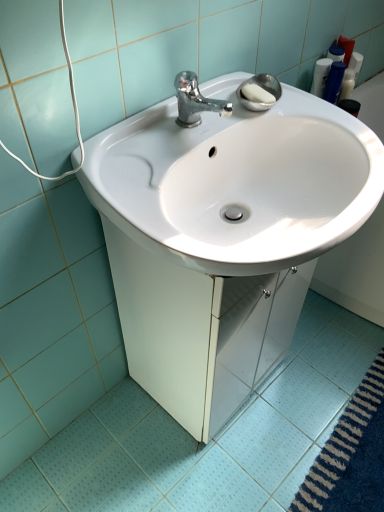
What do you see at coordinates (223, 239) in the screenshot? Image resolution: width=384 pixels, height=512 pixels. I see `white glossy sink at center` at bounding box center [223, 239].

What do you see at coordinates (210, 442) in the screenshot?
I see `white glossy ceramic tile at lower center` at bounding box center [210, 442].

In order to face white glossy sink at center, should I rotate leftwards or rightwards?

Rotate right and turn 26.380 degrees.

At what (x,y) coordinates should I click in order to perform the action: click on white glossy sink at center. Please return your answer as a coordinate pair (x, y). This screenshot has width=384, height=512. Looking at the image, I should click on (223, 239).

Which is more to the left, white glossy sink at center or white glossy ceramic tile at lower center?

white glossy sink at center.

Is the surface of white glossy sink at center in direct contact with white glossy ceramic tile at lower center?

white glossy sink at center is not next to white glossy ceramic tile at lower center, and they're not touching.

Is white glossy sink at center closer to the viewer compared to white glossy ceramic tile at lower center?

Yes.

Can you confirm if white glossy sink at center is shorter than white glossy ceramic tile at lower center?

No, white glossy sink at center is not shorter than white glossy ceramic tile at lower center.

Does point (293, 352) appear closer or farther from the camera than point (198, 94)?

Point (293, 352) is farther from the camera than point (198, 94).

From a real-world perspective, is white glossy ceramic tile at lower center physically located above or below chrome metallic faucet at upper center?

white glossy ceramic tile at lower center is below chrome metallic faucet at upper center.

Between white glossy ceramic tile at lower center and chrome metallic faucet at upper center, which one has larger size?

white glossy ceramic tile at lower center is bigger.

Where is `ceramic tile lying in front of the white glossy sink at center`? Image resolution: width=384 pixels, height=512 pixels. ceramic tile lying in front of the white glossy sink at center is located at coordinates (210, 442).

From a real-world perspective, is white glossy ceramic tile at lower center positioned above or below white glossy sink at center?

Clearly, from a real-world perspective, white glossy ceramic tile at lower center is below white glossy sink at center.

Which of these two, white glossy ceramic tile at lower center or white glossy sink at center, stands taller?

With more height is white glossy sink at center.

Which object is positioned more to the left, white glossy sink at center or chrome metallic faucet at upper center?

chrome metallic faucet at upper center is more to the left.

Who is bigger, white glossy sink at center or chrome metallic faucet at upper center?

white glossy sink at center is bigger.

From a real-world perspective, is white glossy sink at center on top of chrome metallic faucet at upper center?

No, from a real-world perspective, white glossy sink at center is not on top of chrome metallic faucet at upper center.

Which object is wider, white glossy sink at center or chrome metallic faucet at upper center?

Wider between the two is white glossy sink at center.

Is white glossy sink at center spatially inside white glossy ceramic tile at lower center, or outside of it?

white glossy sink at center is outside white glossy ceramic tile at lower center.

Considering the sizes of white glossy sink at center and white glossy ceramic tile at lower center in the image, is white glossy sink at center taller or shorter than white glossy ceramic tile at lower center?

Considering their sizes, white glossy sink at center has more height than white glossy ceramic tile at lower center.

Between point (383, 317) and point (100, 421), which one is positioned behind?

Positioned behind is point (383, 317).

Is white glossy sink at center further to camera compared to white glossy ceramic tile at lower center?

Yes.

Is chrome metallic faucet at upper center to the left of white glossy sink at center from the viewer's perspective?

Indeed, chrome metallic faucet at upper center is positioned on the left side of white glossy sink at center.

Is chrome metallic faucet at upper center thinner than white glossy sink at center?

Correct, the width of chrome metallic faucet at upper center is less than that of white glossy sink at center.

Does chrome metallic faucet at upper center contain white glossy sink at center?

No.

Considering the points (198, 87) and (339, 201), which point is behind, point (198, 87) or point (339, 201)?

Point (198, 87)

Is chrome metallic faucet at upper center wider or thinner than white glossy sink at center?

Considering their sizes, chrome metallic faucet at upper center looks slimmer than white glossy sink at center.

Which object is more forward, chrome metallic faucet at upper center or white glossy sink at center?

white glossy sink at center is closer to the camera.

Is chrome metallic faucet at upper center bigger or smaller than white glossy sink at center?

Clearly, chrome metallic faucet at upper center is smaller in size than white glossy sink at center.

At what (x,y) coordinates should I click in order to perform the action: click on sink in front of the white glossy ceramic tile at lower center. Please return your answer as a coordinate pair (x, y). Looking at the image, I should click on (223, 239).

Locate an element on the screen. The height and width of the screenshot is (512, 384). ceramic tile below the chrome metallic faucet at upper center (from a real-world perspective) is located at coordinates (210, 442).

Considering their positions, is white glossy sink at center positioned further to white glossy ceramic tile at lower center than white glossy sink at center?

white glossy sink at center.

Based on the photo, estimate the real-world distances between objects in this image. Which object is further from white glossy sink at center, white glossy sink at center or white glossy ceramic tile at lower center?

Based on the image, white glossy sink at center appears to be further to white glossy sink at center.

From the image, which object appears to be nearer to white glossy sink at center, white glossy sink at center or chrome metallic faucet at upper center?

The object closer to white glossy sink at center is chrome metallic faucet at upper center.

Looking at the image, which one is located closer to white glossy sink at center, chrome metallic faucet at upper center or white glossy sink at center?

Based on the image, chrome metallic faucet at upper center appears to be nearer to white glossy sink at center.

Which object lies nearer to the anchor point white glossy sink at center, white glossy ceramic tile at lower center or white glossy sink at center?

white glossy ceramic tile at lower center.

Based on the photo, estimate the real-world distances between objects in this image. Which object is further from white glossy ceramic tile at lower center, chrome metallic faucet at upper center or white glossy sink at center?

→ chrome metallic faucet at upper center.

Considering their positions, is chrome metallic faucet at upper center positioned closer to white glossy sink at center than white glossy ceramic tile at lower center?

The object closer to white glossy sink at center is white glossy ceramic tile at lower center.

From the image, which object appears to be nearer to white glossy sink at center, chrome metallic faucet at upper center or white glossy ceramic tile at lower center?

Among the two, chrome metallic faucet at upper center is located nearer to white glossy sink at center.

Identify the location of sink between chrome metallic faucet at upper center and white glossy ceramic tile at lower center in the vertical direction. (223, 239).

At what (x,y) coordinates should I click in order to perform the action: click on sink located between chrome metallic faucet at upper center and white glossy sink at center in the left-right direction. Please return your answer as a coordinate pair (x, y). The height and width of the screenshot is (512, 384). Looking at the image, I should click on (223, 239).

Identify the location of bath that lies between chrome metallic faucet at upper center and white glossy ceramic tile at lower center from top to bottom. The height and width of the screenshot is (512, 384). (356, 270).

Locate an element on the screen. This screenshot has height=512, width=384. sink between white glossy sink at center and white glossy ceramic tile at lower center in the up-down direction is located at coordinates (223, 239).